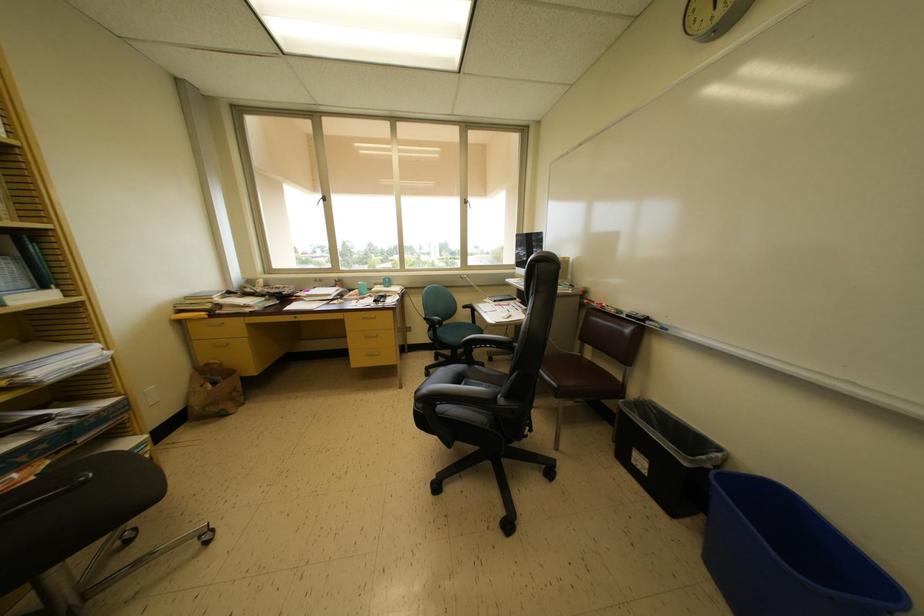
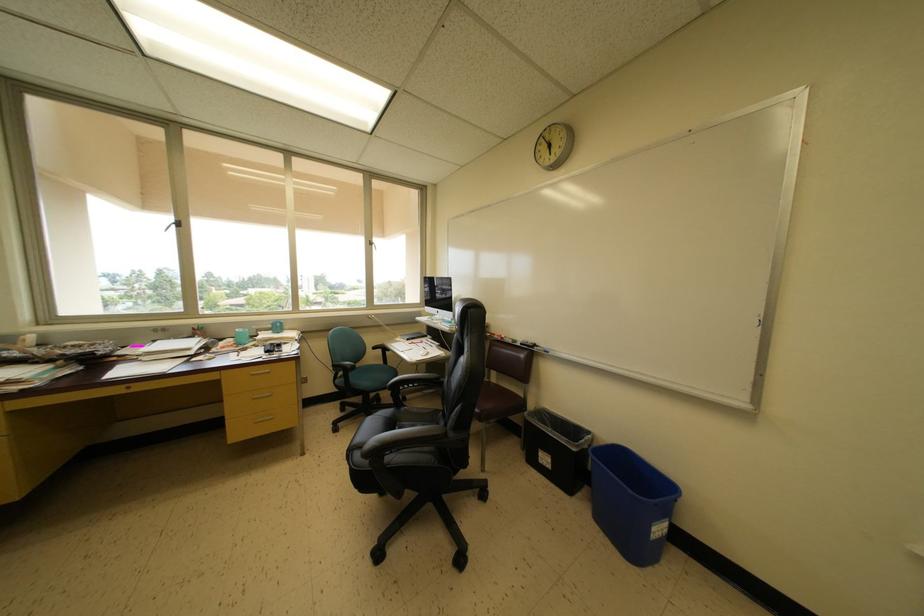
The point at (468, 389) is marked in the first image. Where is the corresponding point in the second image?

(400, 432)